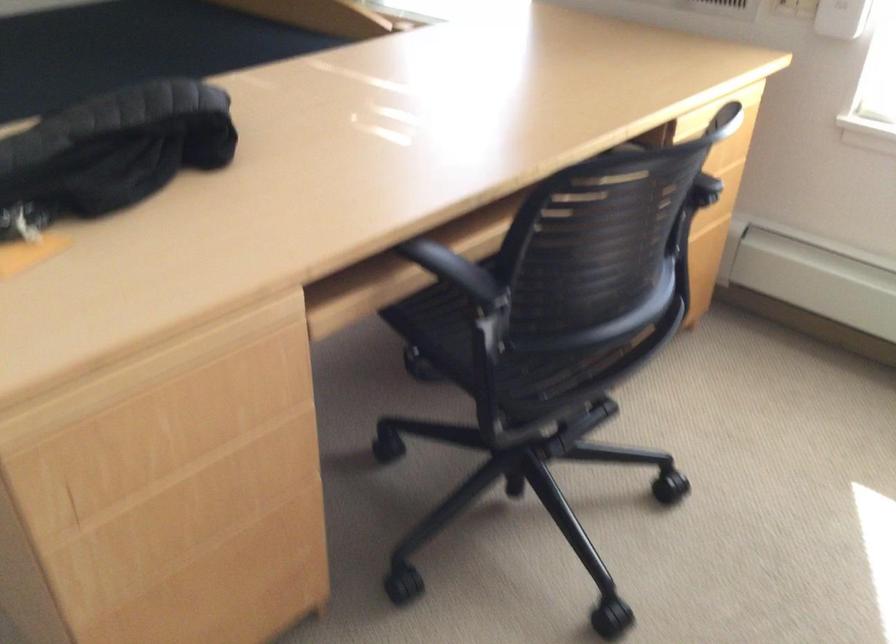
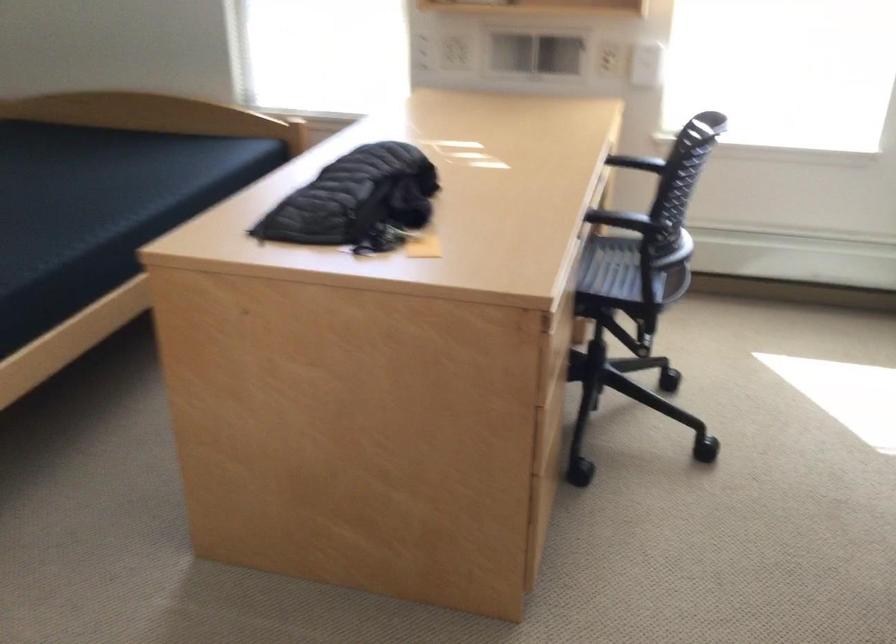
In the second image, find the point that corresponds to pixel 418 254 in the first image.

(597, 216)